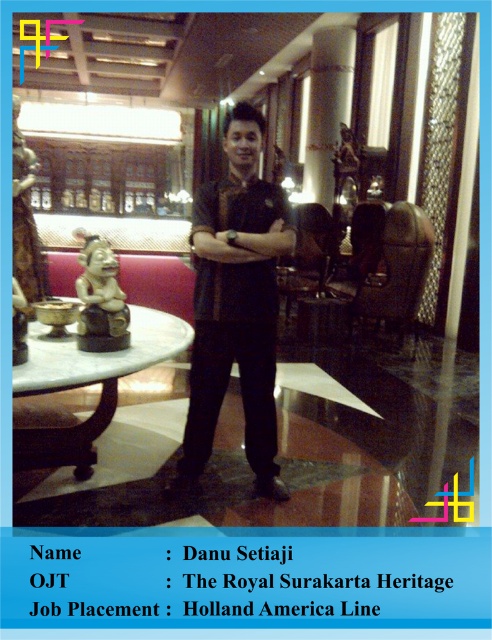
Based on the photo, is matte black shirt at center wider than white marble table at center?

No, matte black shirt at center is not wider than white marble table at center.

Between point (287, 227) and point (79, 384), which one is positioned in front?

Point (79, 384) is more forward.

The height and width of the screenshot is (640, 492). I want to click on matte black shirt at center, so click(x=236, y=305).